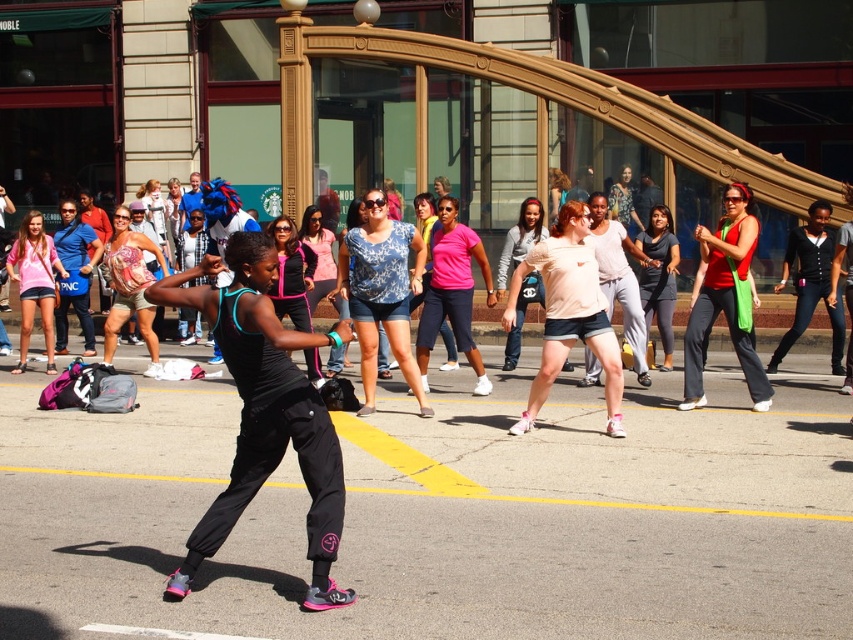
Question: Based on their relative distances, which object is farther from the pink fabric shorts at center?

Choices:
 (A) matte blue tank top at center
 (B) matte pink shirt at left
 (C) matte red tank top at center
 (D) denim shorts at center

Answer: (B)

Question: Does black matte athletic pants at center come behind pink matte shirt at center?

Choices:
 (A) no
 (B) yes

Answer: (A)

Question: Does pink fabric shorts at center have a larger size compared to denim shorts at center?

Choices:
 (A) no
 (B) yes

Answer: (A)

Question: Among these objects, which one is farthest from the camera?

Choices:
 (A) black matte athletic pants at center
 (B) pink track pants at center
 (C) matte gray tank top at center
 (D) denim shorts at center

Answer: (C)

Question: Which point is closer to the camera?

Choices:
 (A) black matte athletic pants at center
 (B) pink matte shirt at center

Answer: (A)

Question: Can you confirm if pink fabric shorts at center is positioned to the left of pink fabric shirt at center?

Choices:
 (A) no
 (B) yes

Answer: (A)